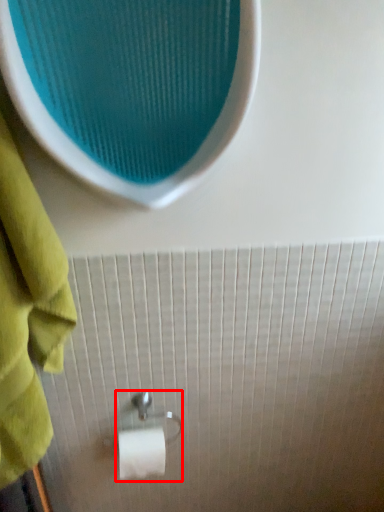
Question: From the image's perspective, where is towel bar (annotated by the red box) located relative to towel?

Choices:
 (A) above
 (B) below

Answer: (B)